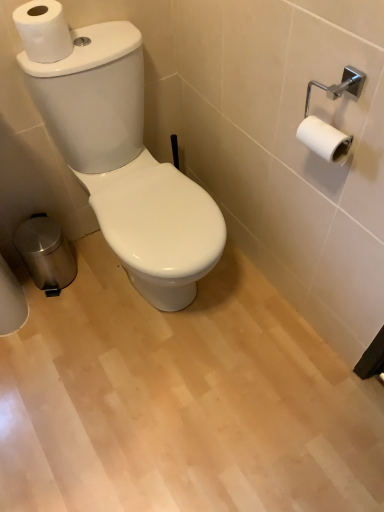
Locate an element on the screen. The height and width of the screenshot is (512, 384). free location in front of polished stainless steel trash bin at lower left is located at coordinates (54, 317).